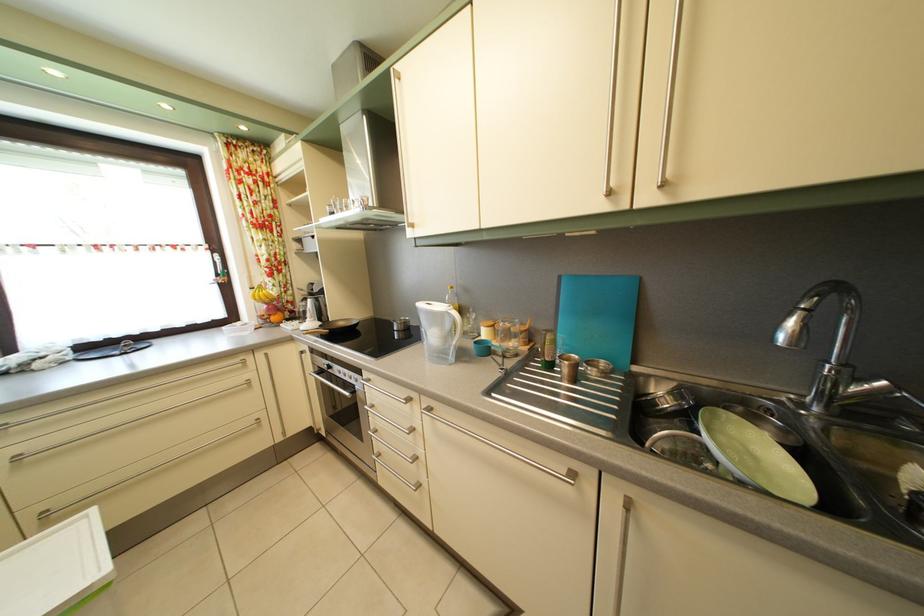
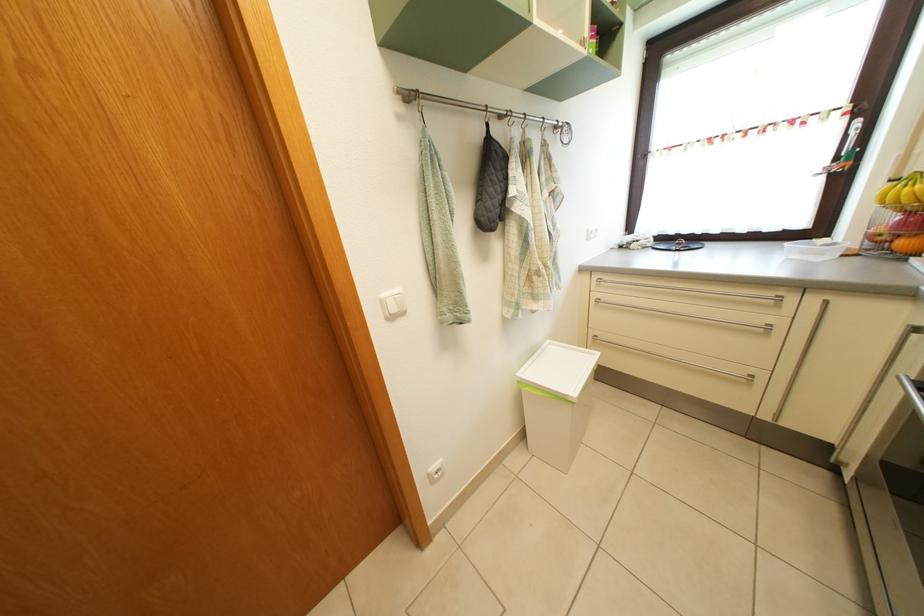
In the second image, find the point that corresponds to [70,509] in the first image.

(611, 344)